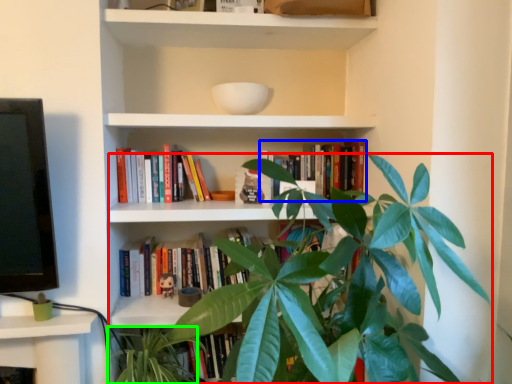
Question: Based on their relative distances, which object is nearer to houseplant (highlighted by a red box)? Choose from book (highlighted by a blue box) and vegetation (highlighted by a green box).

Choices:
 (A) book
 (B) vegetation

Answer: (A)